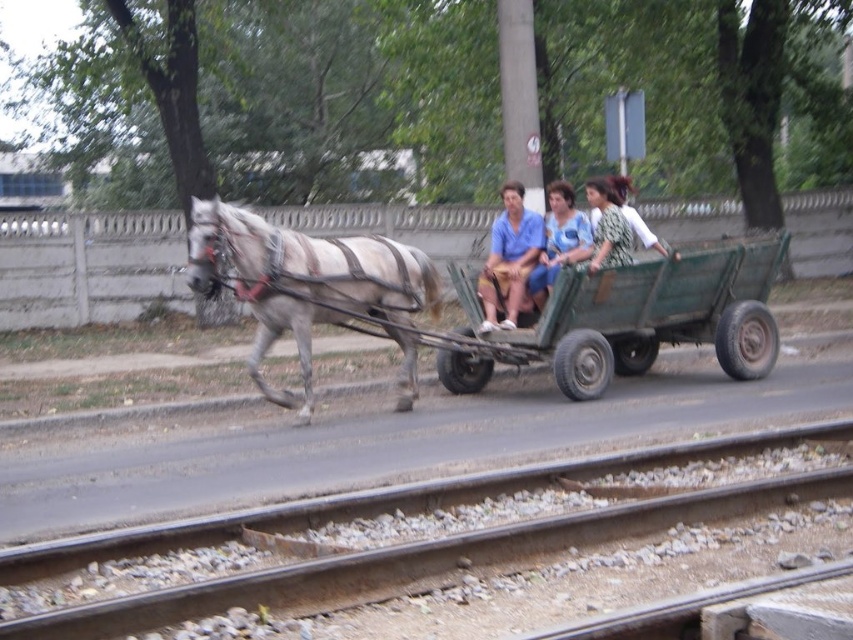
You are a photographer trying to capture a photo of the green wooden wagon at center and the printed fabric dress at center. Which object should you focus on first if you want to ensure both are in the frame without moving the camera? Explain your reasoning based on their sizes.

The green wooden wagon at center is bigger than the printed fabric dress at center. Since the wagon is larger, focusing on it first would help ensure both objects fit within the frame as the dress is smaller and easier to include once the wagon is centered.

You are a delivery person who needs to place a package between the green wooden wagon at center and the printed fabric dress at center. The package requires 4 feet of space. Can you fit it between them?

The green wooden wagon at center is 3.91 feet from the printed fabric dress at center, so the package requiring 4 feet of space cannot fit between them as there is insufficient space.

You are a cart driver who wants to ensure the rusty metal train track at lower center is visible in your rearview mirror. The mirror shows the area at point coordinates between 0.8 and 0.9 on the x and y axes. Is the track visible?

The rusty metal train track at lower center is located at point coordinates 0.872 and 0.496, which falls within the mirror view area between 0.8 and 0.9 on both axes. Therefore, the track is visible in the rearview mirror.